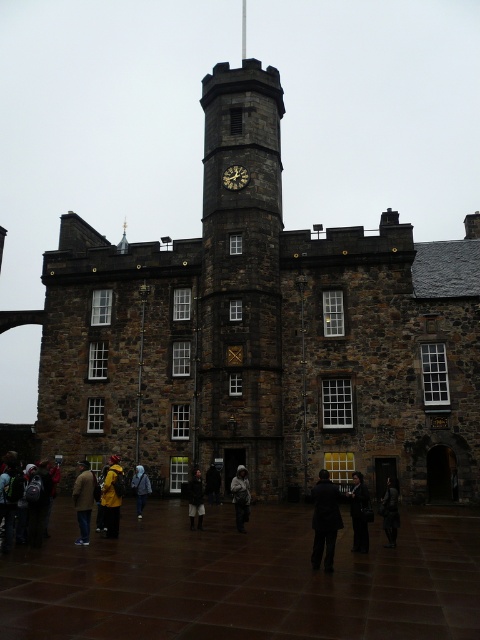
Can you confirm if dark gray stone clock tower at center is positioned to the left of yellow matte jacket at lower left?

Incorrect, dark gray stone clock tower at center is not on the left side of yellow matte jacket at lower left.

Is point (250, 266) less distant than point (120, 468)?

No, (250, 266) is behind (120, 468).

Between point (214, 81) and point (117, 477), which one is positioned behind?

The point (214, 81) is more distant.

This screenshot has height=640, width=480. What are the coordinates of `dark gray stone clock tower at center` in the screenshot? It's located at (240, 278).

Is dark brown wooden clock at center positioned at the back of dark brown leather jacket at center?

Yes, dark brown wooden clock at center is behind dark brown leather jacket at center.

Who is taller, dark brown wooden clock at center or dark brown leather jacket at center?

dark brown leather jacket at center

Where is `dark brown wooden clock at center`? dark brown wooden clock at center is located at coordinates (235, 177).

Is point (357, 515) positioned behind point (211, 497)?

No, it is not.

Is dark brown leather coat at center shorter than dark brown leather jacket at center?

Incorrect, dark brown leather coat at center's height does not fall short of dark brown leather jacket at center's.

Image resolution: width=480 pixels, height=640 pixels. I want to click on dark brown leather coat at center, so point(359,513).

In order to click on dark brown leather coat at center in this screenshot , I will do `click(359, 513)`.